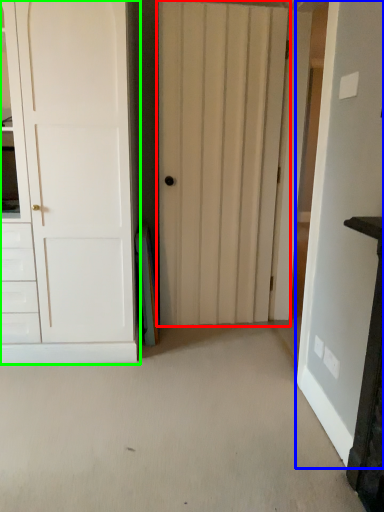
Question: Which is nearer to the door (highlighted by a red box)? door (highlighted by a blue box) or door (highlighted by a green box).

Choices:
 (A) door
 (B) door

Answer: (B)